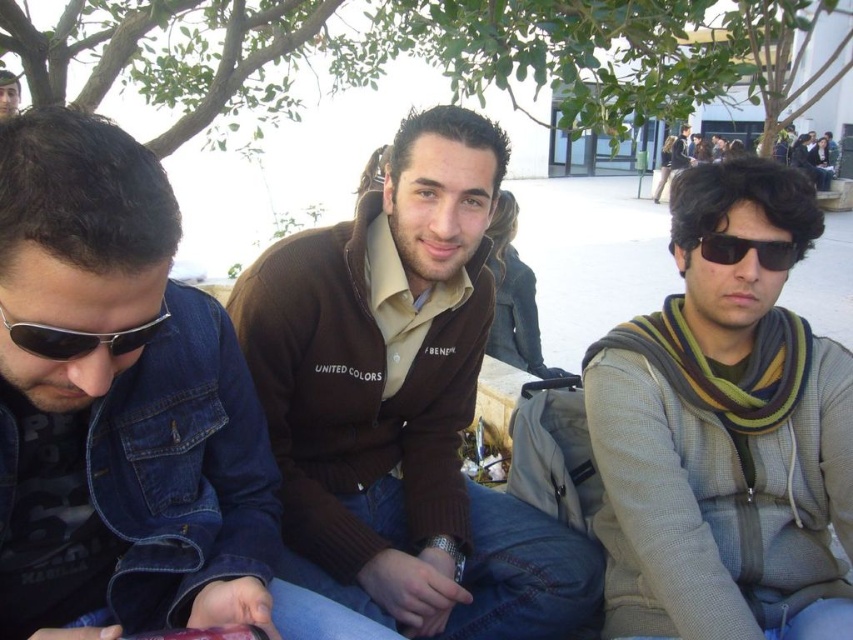
Does brown sweater at center appear on the left side of striped scarf at right?

Indeed, brown sweater at center is positioned on the left side of striped scarf at right.

Does point (323, 557) come closer to viewer compared to point (724, 394)?

That is False.

Which is behind, point (457, 353) or point (827, 376)?

The point (457, 353) is more distant.

Where is `brown sweater at center`? The width and height of the screenshot is (853, 640). brown sweater at center is located at coordinates (402, 403).

Can you confirm if sunglasses at left is bigger than black plastic sunglasses at right?

Actually, sunglasses at left might be smaller than black plastic sunglasses at right.

Who is more distant from viewer, (107, 339) or (723, 256)?

The point (723, 256) is behind.

The width and height of the screenshot is (853, 640). Find the location of `sunglasses at left`. sunglasses at left is located at coordinates (79, 337).

Is brushed denim jacket at lower left to the left of sunglasses at left from the viewer's perspective?

No, brushed denim jacket at lower left is not to the left of sunglasses at left.

Is point (161, 416) more distant than point (119, 332)?

Yes, point (161, 416) is farther from viewer.

Locate an element on the screen. This screenshot has height=640, width=853. brushed denim jacket at lower left is located at coordinates (132, 368).